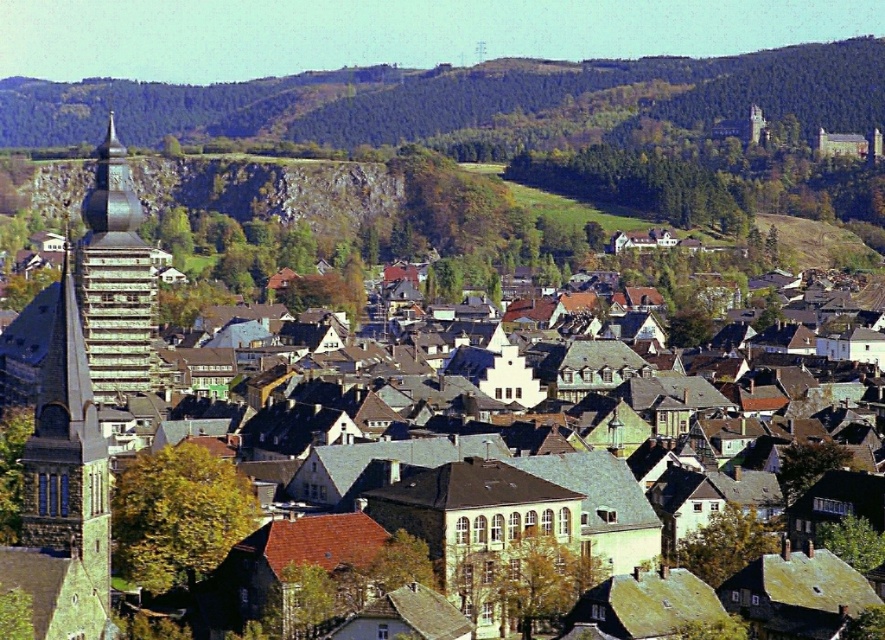
Can you confirm if green forested hill at upper center is positioned below green glass tower at left?

No, green forested hill at upper center is not below green glass tower at left.

The height and width of the screenshot is (640, 885). What do you see at coordinates (459, 99) in the screenshot? I see `green forested hill at upper center` at bounding box center [459, 99].

Between point (431, 72) and point (113, 332), which one is positioned behind?

The point (431, 72) is more distant.

Identify the location of green forested hill at upper center. (459, 99).

Does green stone church steeple at left have a larger size compared to green glass tower at left?

No.

You are a GUI agent. You are given a task and a screenshot of the screen. Output one action in this format:
    pyautogui.click(x=<x>, y=<y>)
    Task: Click on the green stone church steeple at left
    
    Given the screenshot: What is the action you would take?
    pyautogui.click(x=64, y=492)

Who is more forward, (12,548) or (141,372)?

Point (12,548)

I want to click on green stone church steeple at left, so click(x=64, y=492).

Does point (32, 88) lie in front of point (94, 436)?

No, (32, 88) is behind (94, 436).

The image size is (885, 640). I want to click on green forested hill at upper center, so click(459, 99).